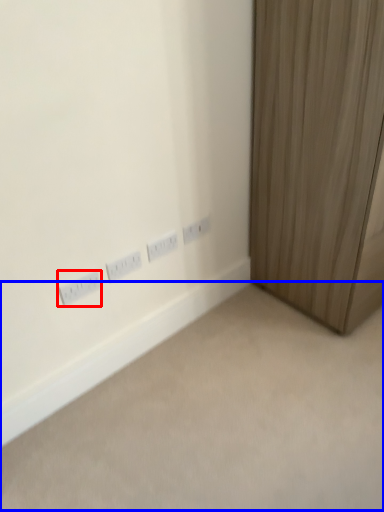
Question: Which object is further to the camera taking this photo, power plugs and sockets (highlighted by a red box) or plain (highlighted by a blue box)?

Choices:
 (A) power plugs and sockets
 (B) plain

Answer: (A)